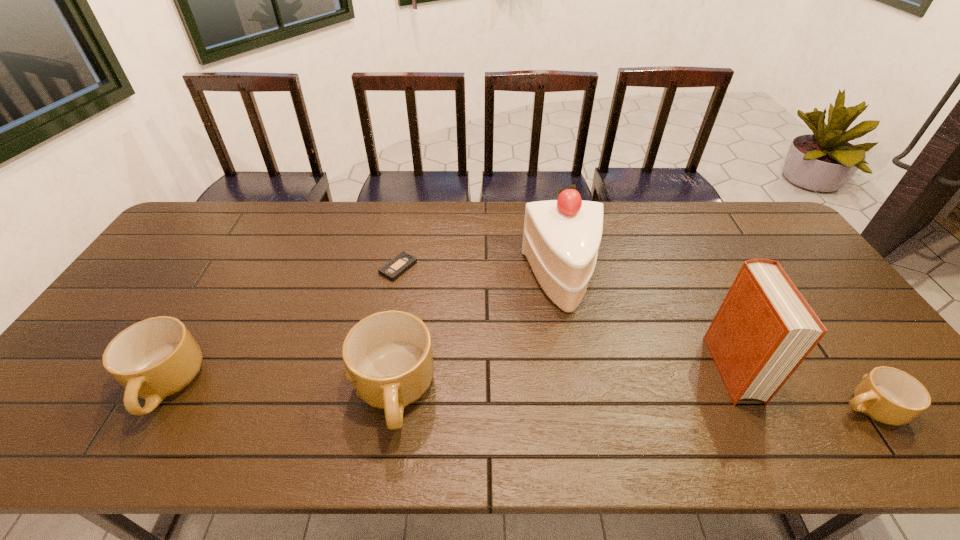
Identify the location of free space between the fifth object from left to right and the second shortest mug. This screenshot has height=540, width=960. (448, 377).

This screenshot has width=960, height=540. In order to click on free space that is in between the hardback book and the cake in this screenshot , I will do `click(647, 325)`.

Find the location of a particular element. This screenshot has height=540, width=960. empty location between the leftmost mug and the hardback book is located at coordinates (448, 377).

In order to click on free space between the fifth object from left to right and the third object from right to left in this screenshot , I will do 647,325.

Locate an element on the screen. Image resolution: width=960 pixels, height=540 pixels. free point between the shortest mug and the second mug from right to left is located at coordinates (631, 401).

Identify the location of vacant space that's between the hardback book and the rightmost object. The height and width of the screenshot is (540, 960). (800, 388).

Where is `free space between the shortest object and the hardback book`? This screenshot has height=540, width=960. free space between the shortest object and the hardback book is located at coordinates (565, 318).

Find the location of `vacant space that is in between the videotape and the third object from right to left`. vacant space that is in between the videotape and the third object from right to left is located at coordinates (480, 274).

This screenshot has width=960, height=540. Identify the location of free space that is in between the hardback book and the second mug from left to right. (563, 381).

Identify which object is the fourth closest to the second shortest mug. Please provide its 2D coordinates. Your answer should be formatted as a tuple, i.e. [(x, y)], where the tuple contains the x and y coordinates of a point satisfying the conditions above.

[(764, 329)]